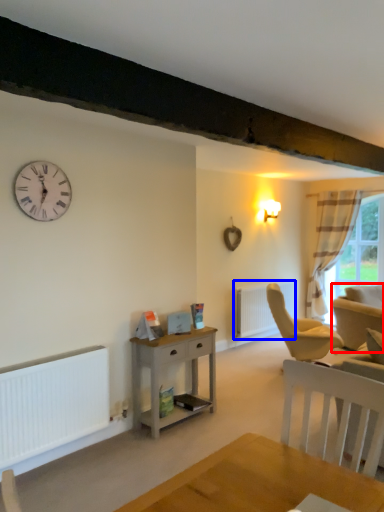
Question: Which point is further to the camera, swivel chair (highlighted by a red box) or radiator (highlighted by a blue box)?

Choices:
 (A) swivel chair
 (B) radiator

Answer: (B)